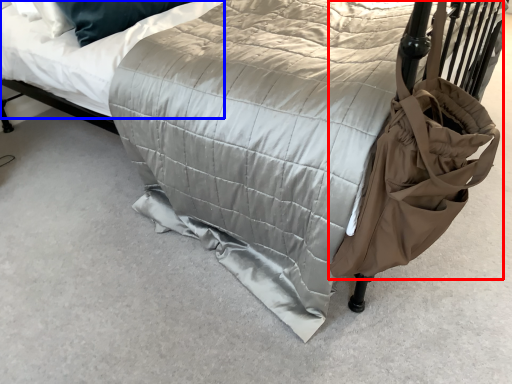
Question: Which of the following is the farthest to the observer, bag (highlighted by a red box) or mattress (highlighted by a blue box)?

Choices:
 (A) bag
 (B) mattress

Answer: (B)